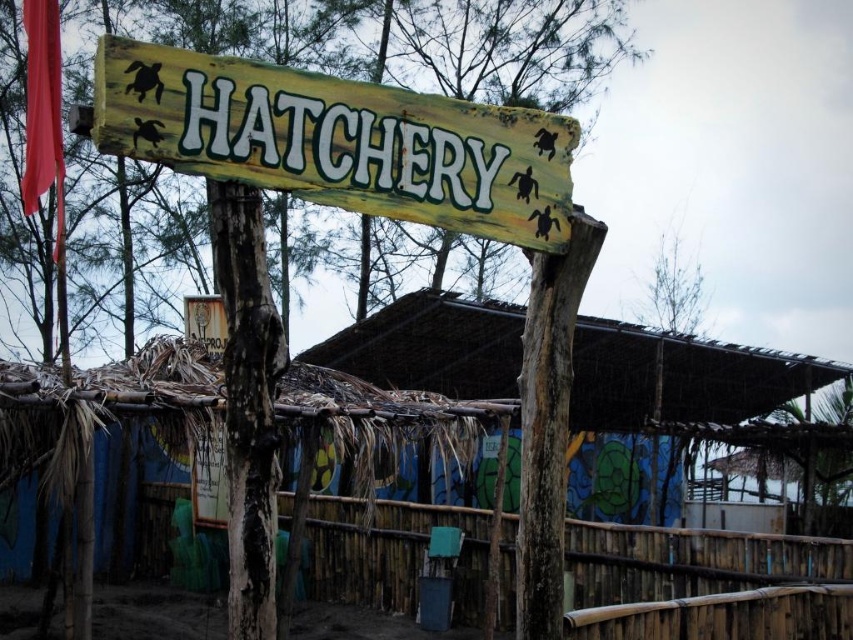
Is bamboo fence at lower center positioned behind black rough wood pole at center?

Yes, it is behind black rough wood pole at center.

Locate an element on the screen. The width and height of the screenshot is (853, 640). bamboo fence at lower center is located at coordinates (692, 561).

Image resolution: width=853 pixels, height=640 pixels. Find the location of `bamboo fence at lower center`. bamboo fence at lower center is located at coordinates (692, 561).

Is wooden signboard at center shorter than black rough wood pole at center?

Indeed, wooden signboard at center has a lesser height compared to black rough wood pole at center.

Describe the element at coordinates (339, 140) in the screenshot. I see `wooden signboard at center` at that location.

This screenshot has height=640, width=853. I want to click on wooden signboard at center, so click(339, 140).

The height and width of the screenshot is (640, 853). Find the location of `wooden signboard at center`. wooden signboard at center is located at coordinates (339, 140).

Can you confirm if thatched roof hut at center is bigger than black rough wood pole at center?

No, thatched roof hut at center is not bigger than black rough wood pole at center.

Locate an element on the screen. The image size is (853, 640). thatched roof hut at center is located at coordinates (680, 376).

Which is in front, point (709, 404) or point (215, 284)?

Point (709, 404)

Where is `thatched roof hut at center`? thatched roof hut at center is located at coordinates (680, 376).